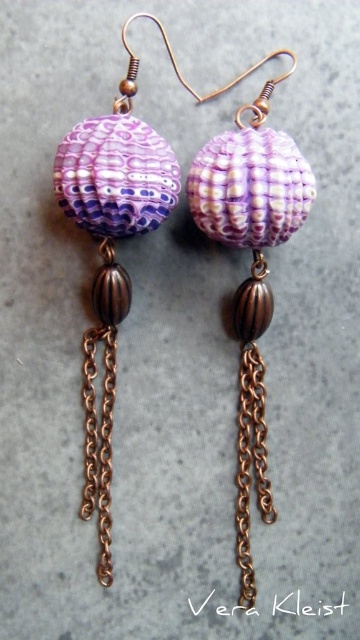
Question: Where is matte purple shell at left located in relation to copper chain at lower center in the image?

Choices:
 (A) above
 (B) below

Answer: (A)

Question: Considering the real-world distances, which object is farthest from the copper chain at lower center?

Choices:
 (A) matte purple shell at left
 (B) copper chain at center

Answer: (A)

Question: Is matte purple shell at left positioned at the back of copper chain at lower center?

Choices:
 (A) no
 (B) yes

Answer: (A)

Question: Which is nearer to the copper chain at center?

Choices:
 (A) matte purple shell at left
 (B) copper chain at lower center

Answer: (A)

Question: Does matte purple shell at left appear under copper chain at lower center?

Choices:
 (A) yes
 (B) no

Answer: (B)

Question: Considering the real-world distances, which object is farthest from the copper chain at center?

Choices:
 (A) matte purple shell at left
 (B) copper chain at lower center

Answer: (B)